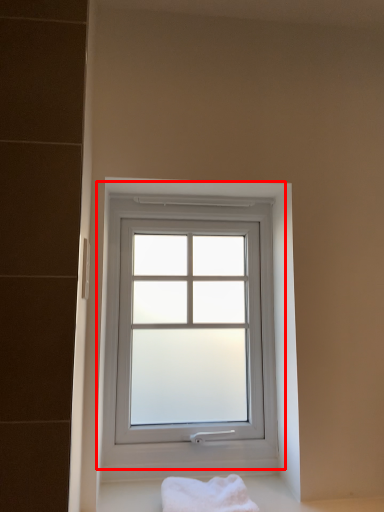
Question: From the image's perspective, what is the correct spatial relationship of window (annotated by the red box) in relation to bath towel?

Choices:
 (A) below
 (B) above

Answer: (B)